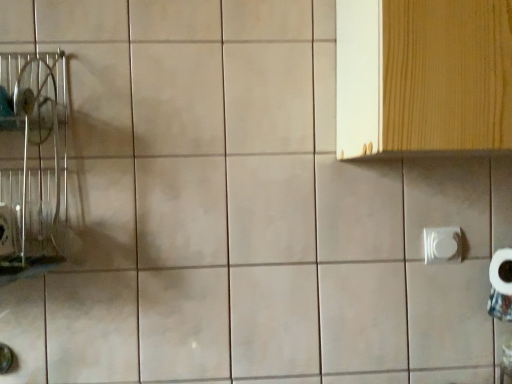
What are the coordinates of `white glossy toilet paper at lower right` in the screenshot? It's located at click(x=442, y=245).

This screenshot has height=384, width=512. Describe the element at coordinates (442, 245) in the screenshot. I see `white glossy toilet paper at lower right` at that location.

At what (x,y) coordinates should I click in order to perform the action: click on white glossy toilet paper at lower right. Please return your answer as a coordinate pair (x, y). The height and width of the screenshot is (384, 512). Looking at the image, I should click on (442, 245).